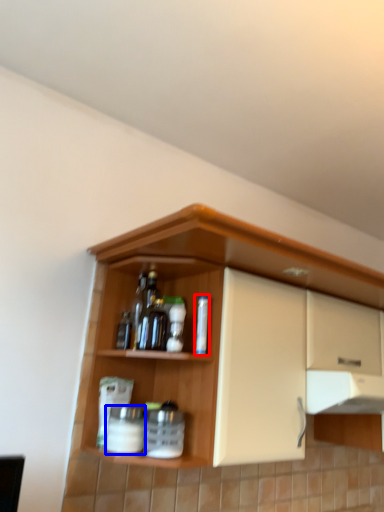
Question: Which object is closer to the camera taking this photo, bottle (highlighted by a red box) or beverage (highlighted by a blue box)?

Choices:
 (A) bottle
 (B) beverage

Answer: (B)